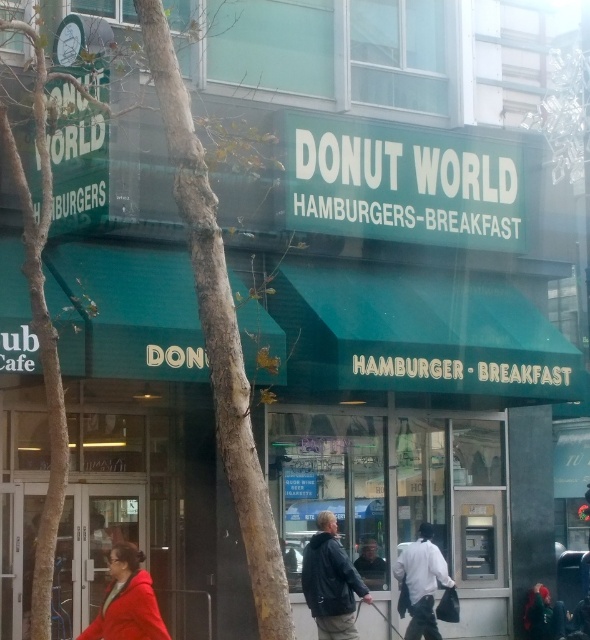
You are standing at the entrance of the restaurant and see the matte red coat at lower left. If you walk straight towards the coat, how far will you have to walk to reach it?

The matte red coat at lower left is 10.65 meters away from the entrance, so you will have to walk 10.65 meters to reach it.

From the picture: You are standing in front of the restaurant and see the matte red coat at lower left and the dark gray jacket at center. Which one is closer to the left side of the entrance?

The matte red coat at lower left is closer to the left side of the entrance because it is to the left of the dark gray jacket at center.